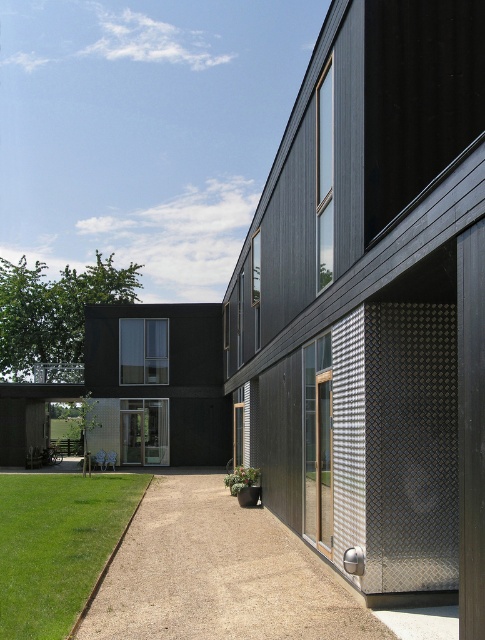
You are a landscape designer planning to install a new garden. You have a limited budget and must choose between expanding the smooth gravel driveway at center or the green grass at lower left. Based on their sizes, which area would be more cost effective to modify?

The smooth gravel driveway at center is smaller than the green grass at lower left, so expanding the green grass at lower left would be more cost effective since it is larger and requires less additional materials compared to modifying the smaller driveway.

You are a delivery person with a cart that is 6 feet wide. You need to move from the green grass at lower left to the smooth gravel driveway at center. Is there enough space for your cart to pass through the gap between them?

The distance between the smooth gravel driveway at center and green grass at lower left is 6.05 feet, which is slightly wider than the cart. Therefore, the cart can pass through the gap between them.